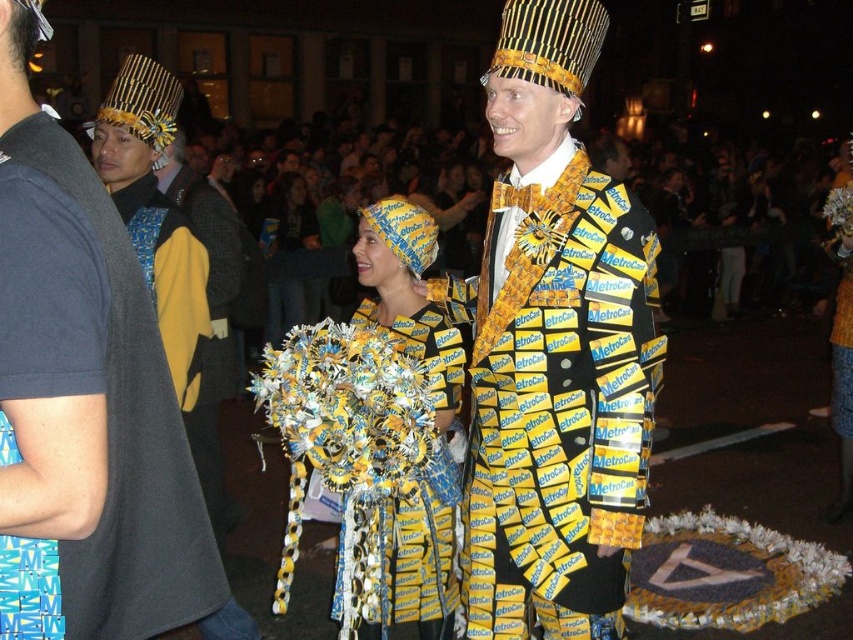
You are a photographer at the parade and want to capture a photo of the yellow paper suit at center and the yellow paper at center. Which one is positioned lower in the image?

The yellow paper suit at center is positioned below the yellow paper at center in the image.

You are a photographer at the parade and want to capture both point of interest marked as point (407, 444) and point (299, 177) in the same frame. Since you want to focus on the subject in front, which point should you prioritize positioning closer to the camera?

A: Point (407, 444) is in front of point (299, 177), so you should prioritize positioning point (407, 444) closer to the camera to ensure it remains the main focus while still including point (299, 177) in the frame.